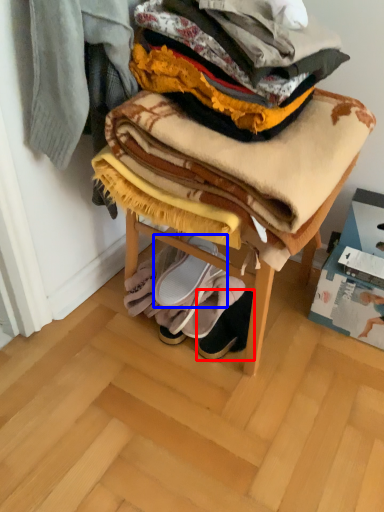
Question: Which object appears farthest to the camera in this image, footwear (highlighted by a red box) or footwear (highlighted by a blue box)?

Choices:
 (A) footwear
 (B) footwear

Answer: (B)